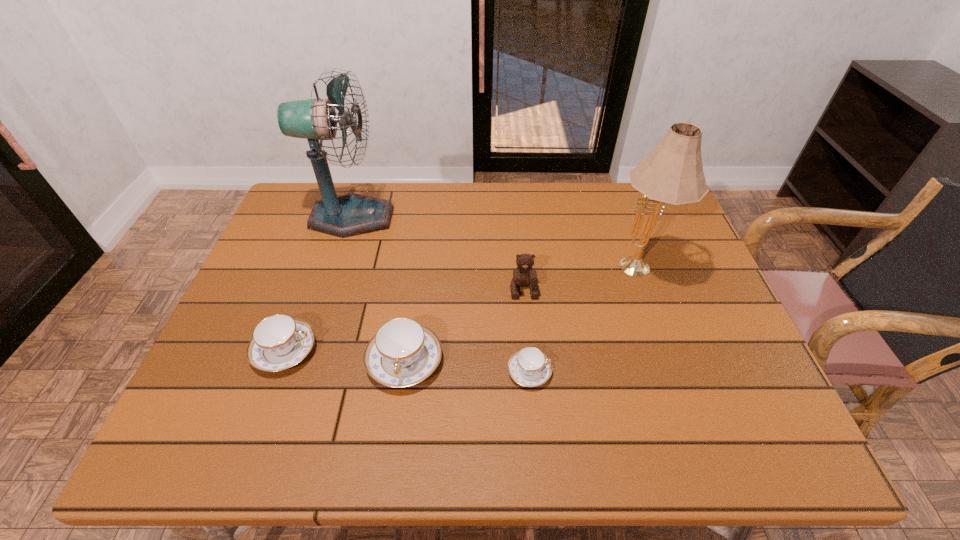
The width and height of the screenshot is (960, 540). I want to click on vacant point located 0.240m on the left of the lampshade, so click(518, 271).

This screenshot has width=960, height=540. What are the coordinates of `vacant space situated in front of the fan where the wind blows` in the screenshot? It's located at (510, 218).

Find the location of `free space located 0.230m on the face of the teddy bear`. free space located 0.230m on the face of the teddy bear is located at coordinates (532, 378).

Find the location of a particular element. The image size is (960, 540). object positioned at the far edge is located at coordinates (353, 214).

Locate an element on the screen. teacup present at the left edge is located at coordinates (279, 342).

The width and height of the screenshot is (960, 540). In order to click on fan at the left edge in this screenshot , I will do `click(353, 214)`.

This screenshot has width=960, height=540. I want to click on object that is positioned at the right edge, so coord(673,173).

You are a GUI agent. You are given a task and a screenshot of the screen. Output one action in this format:
    pyautogui.click(x=<x>, y=<y>)
    Task: Click on the object located at the far left corner
    This screenshot has width=960, height=540.
    Given the screenshot: What is the action you would take?
    pyautogui.click(x=353, y=214)

Identify the location of object located in the near left corner section of the desktop. This screenshot has width=960, height=540. (279, 342).

Where is `vacant area at the far edge of the desktop`? This screenshot has height=540, width=960. vacant area at the far edge of the desktop is located at coordinates (608, 223).